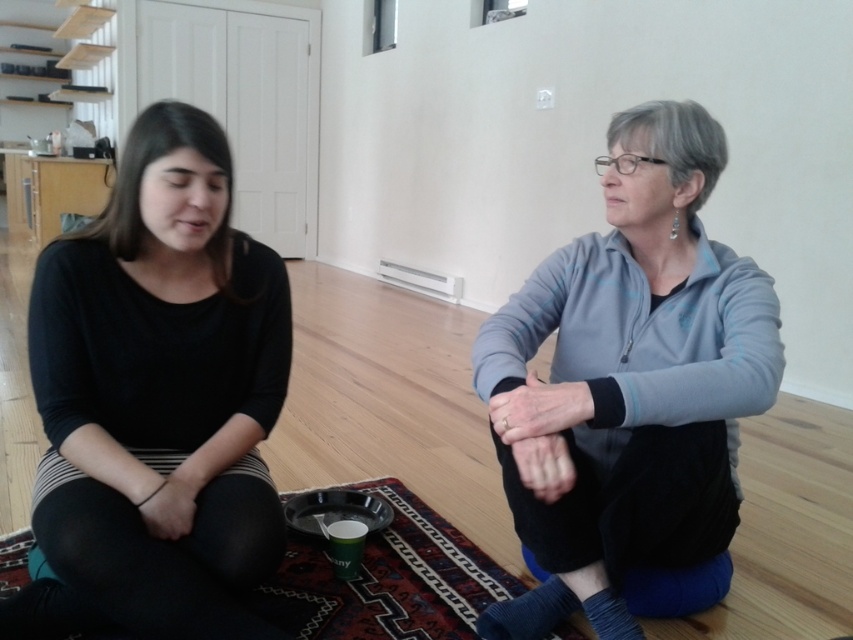
Question: Which point is closer to the camera taking this photo?

Choices:
 (A) (714, 410)
 (B) (407, 513)

Answer: (A)

Question: Is black matte shirt at left to the left of gray fleece jacket at center from the viewer's perspective?

Choices:
 (A) no
 (B) yes

Answer: (B)

Question: Which point is closer to the camera taking this photo?

Choices:
 (A) (306, 630)
 (B) (610, 410)

Answer: (B)

Question: Which object is farther from the camera taking this photo?

Choices:
 (A) carpeted mat at center
 (B) gray fleece jacket at center

Answer: (A)

Question: Can you confirm if black matte shirt at left is positioned below gray fleece jacket at center?

Choices:
 (A) no
 (B) yes

Answer: (A)

Question: Can you confirm if black matte shirt at left is wider than carpeted mat at center?

Choices:
 (A) yes
 (B) no

Answer: (B)